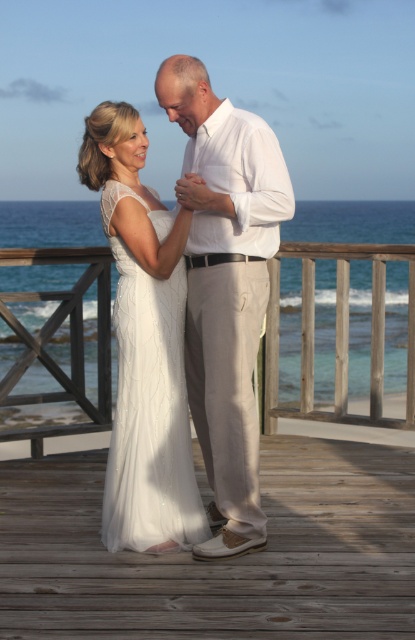
You are a photographer preparing to take a portrait of the two people in the scene. You need to ensure that both the white cotton shirt at center and the white lace dress at center are clearly visible in the frame. Given their sizes, which clothing item might require more careful positioning to avoid being obscured?

The white cotton shirt at center is bigger than the white lace dress at center, so the white cotton shirt at center might require more careful positioning to avoid being obscured because it is larger and could potentially block the view of the white lace dress at center if not arranged properly.

You are standing on the wooden deck and want to place a small gift box between the wooden at center and the white cotton shirt at center. Based on their positions, which object should you place the gift box closer to if you want it to be on the left side of the deck?

You should place the gift box closer to the white cotton shirt at center because the wooden at center is to the right of the white cotton shirt at center, so the white cotton shirt at center is on the left side.

You are a photographer positioned in front of the wooden deck where the two people are standing. You want to capture a photo that includes both the white cotton shirt at center and the white lace dress at center. Which one should you focus on first to ensure both are in sharp focus?

You should focus on the white cotton shirt at center first because it is closer to the viewer than the white lace dress at center, ensuring both will be in focus when using a shallow depth of field.